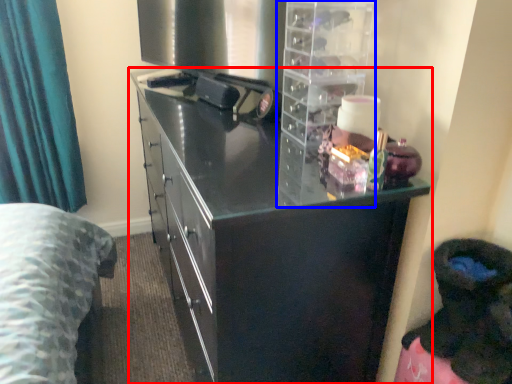
Question: Which object appears closest to the camera in this image, cupboard (highlighted by a red box) or cabinet (highlighted by a blue box)?

Choices:
 (A) cupboard
 (B) cabinet

Answer: (A)